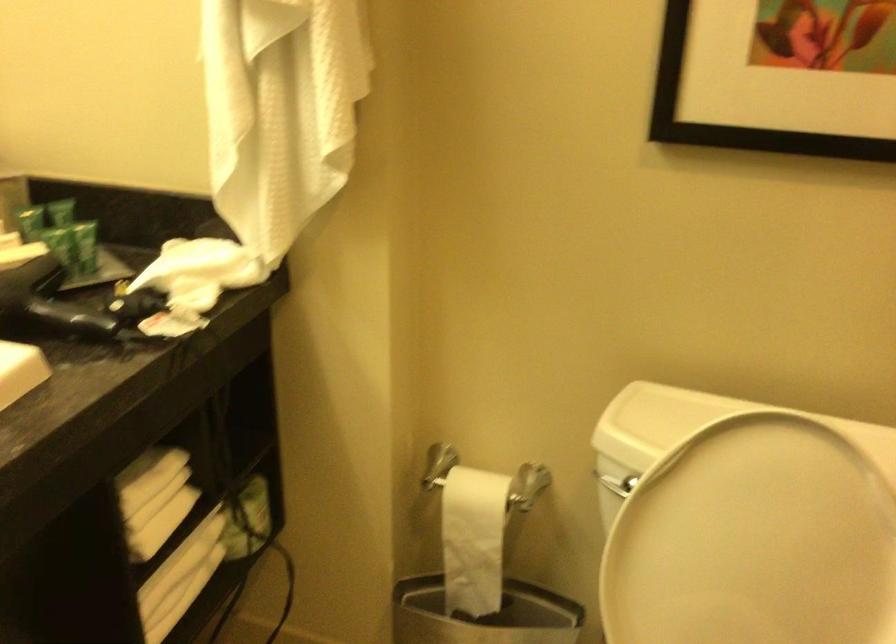
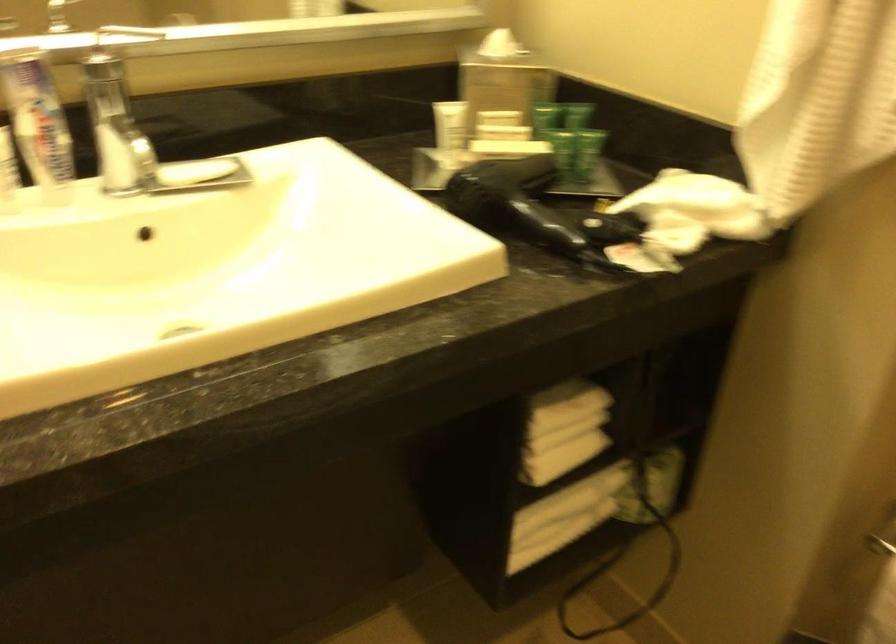
Find the pixel in the second image that matches point 85,243 in the first image.

(589, 151)